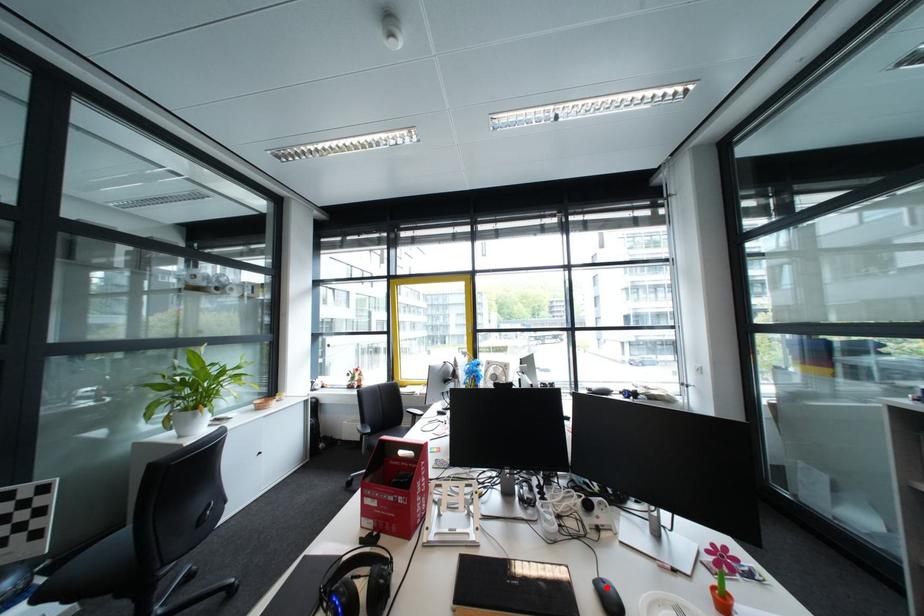
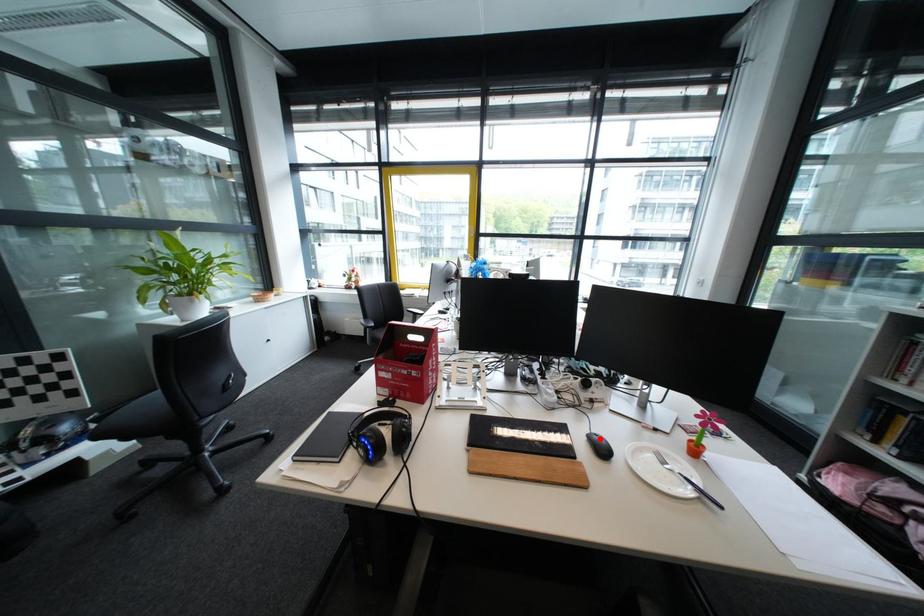
I am providing you with two images of the same scene from different viewpoints. A red point is marked on the first image and another point is marked on the second image. Does the point marked in image1 correspond to the same location as the one in image2?

Yes